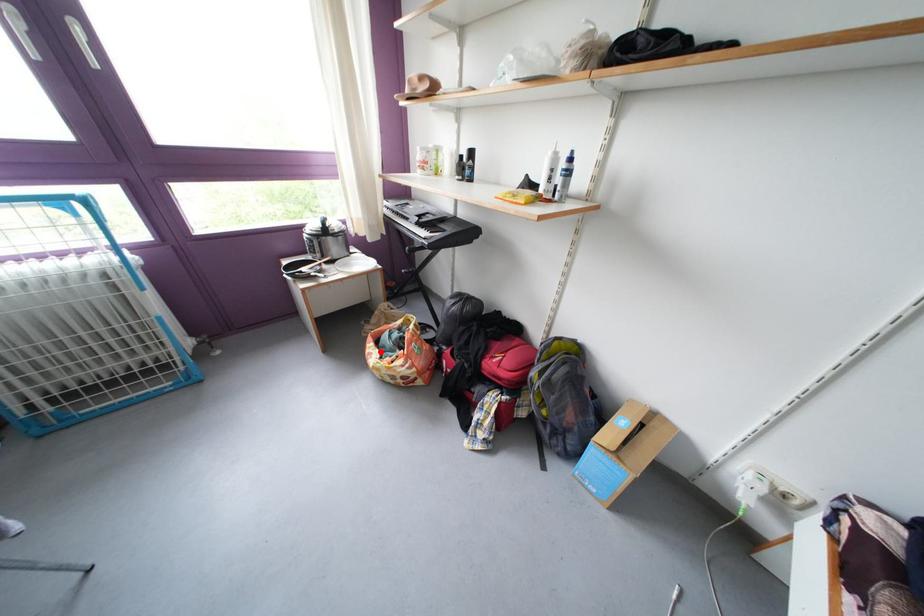
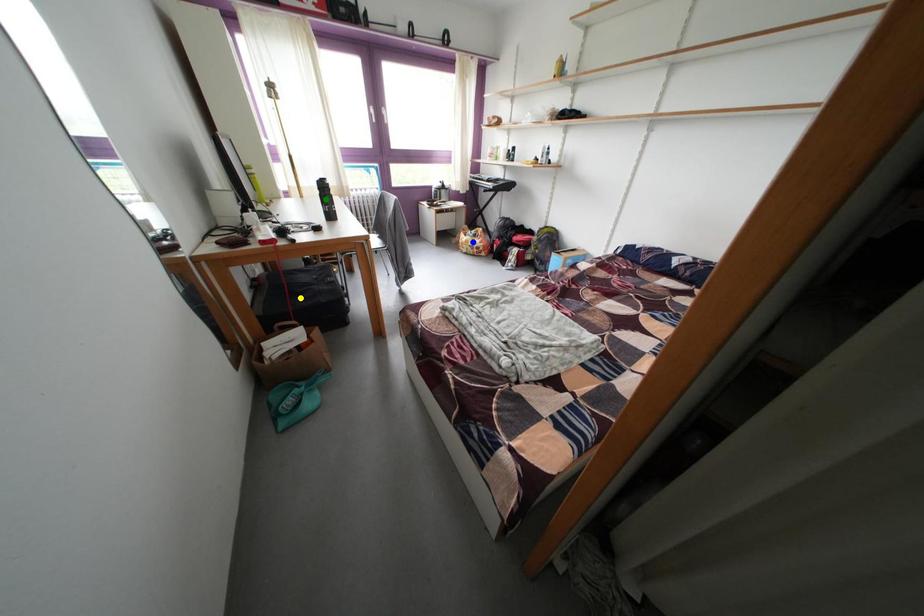
Question: I am providing you with two images of the same scene from different viewpoints. A red point is marked on the first image. You are given multiple points on the second image. Which point in image 2 represents the same 3d spot as the red point in image 1?

Choices:
 (A) yellow point
 (B) green point
 (C) blue point

Answer: (C)